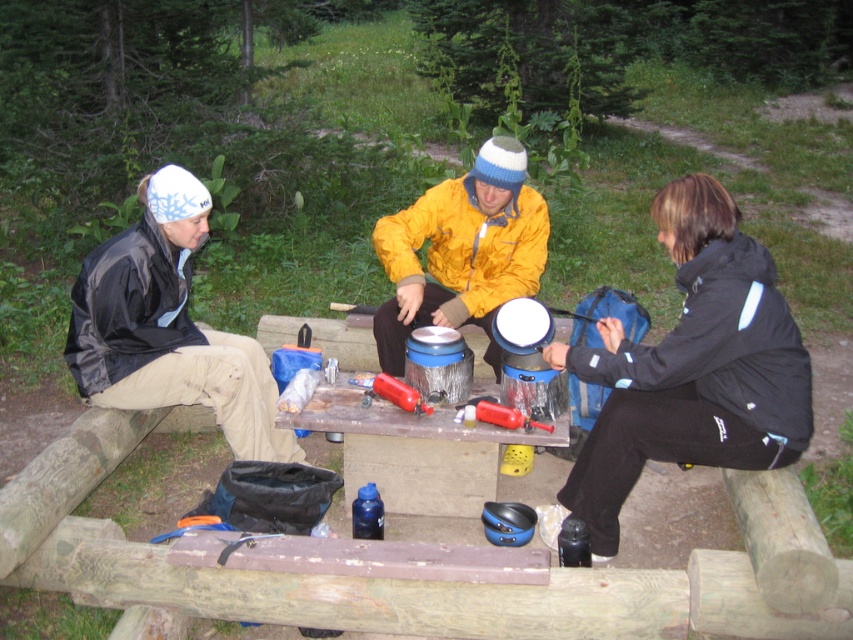
Question: Which point appears closest to the camera in this image?

Choices:
 (A) (195, 364)
 (B) (390, 310)

Answer: (A)

Question: Observing the image, what is the correct spatial positioning of matte black jacket at left in reference to black matte jacket at left?

Choices:
 (A) below
 (B) above

Answer: (A)

Question: Can you confirm if matte black jacket at left is smaller than black matte jacket at left?

Choices:
 (A) no
 (B) yes

Answer: (A)

Question: Which of the following is the farthest from the observer?

Choices:
 (A) matte black jacket at left
 (B) black matte jacket at left
 (C) yellow matte jacket at center

Answer: (C)

Question: Is matte black jacket at left to the left of black matte jacket at left from the viewer's perspective?

Choices:
 (A) yes
 (B) no

Answer: (B)

Question: Which point is closer to the camera?

Choices:
 (A) (465, 205)
 (B) (686, 307)
 (C) (254, 352)

Answer: (B)